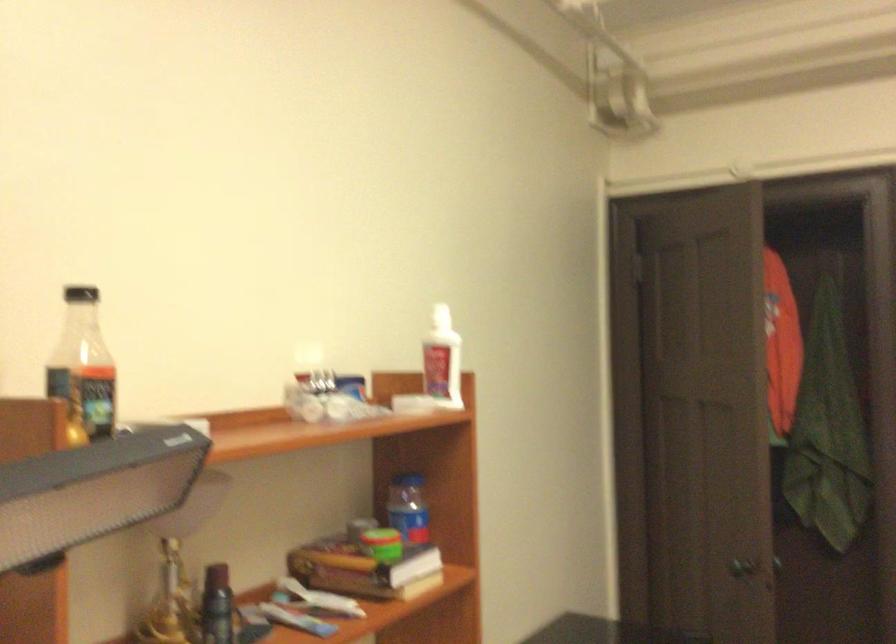
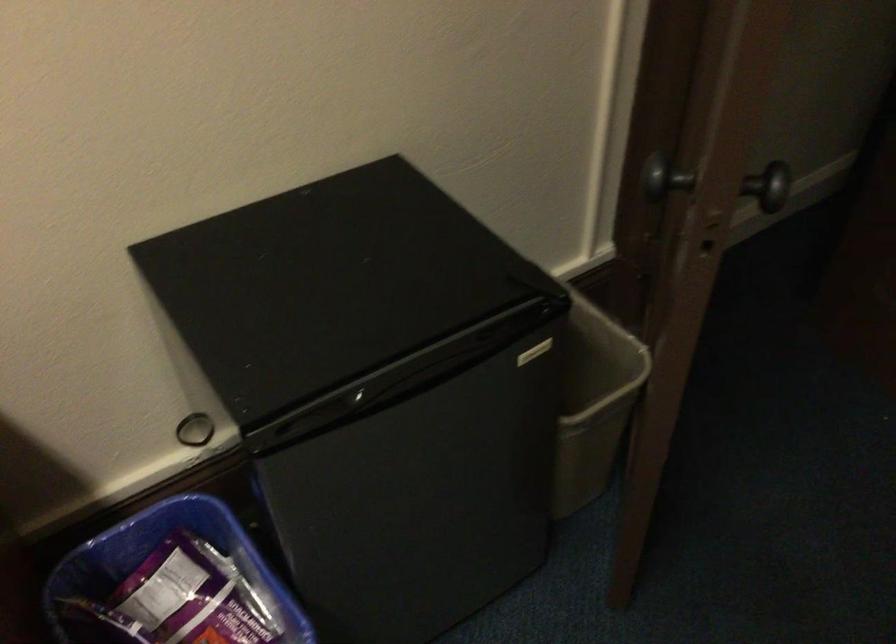
In the second image, find the point that corresponds to point 739,556 in the first image.

(656, 174)